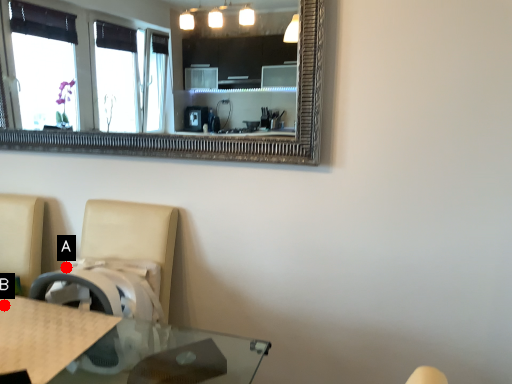
Question: Two points are circled on the image, labeled by A and B beside each circle. Which point appears closest to the camera in this image?

Choices:
 (A) A is closer
 (B) B is closer

Answer: (B)